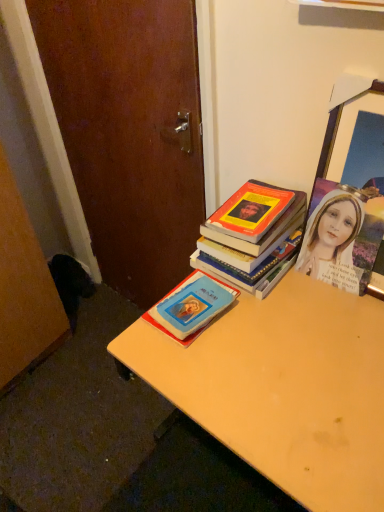
Question: Do you think wooden picture frame at upper right is within hardcover book at center, which ranks as the 1th book in top-to-bottom order, or outside of it?

Choices:
 (A) inside
 (B) outside

Answer: (B)

Question: From a real-world perspective, relative to hardcover book at center, which is the second book from bottom to top, is wooden picture frame at upper right vertically above or below?

Choices:
 (A) above
 (B) below

Answer: (A)

Question: Estimate the real-world distances between objects in this image. Which object is closer to the blue matte book at center, arranged as the second book when viewed from the top?

Choices:
 (A) hardcover book at center, which ranks as the 1th book in top-to-bottom order
 (B) wooden picture frame at upper right
 (C) light brown wooden desk at center

Answer: (A)

Question: Which object is positioned closest to the light brown wooden desk at center?

Choices:
 (A) wooden picture frame at upper right
 (B) hardcover book at center, which ranks as the 1th book in top-to-bottom order
 (C) blue matte book at center, the first book ordered from the bottom

Answer: (C)